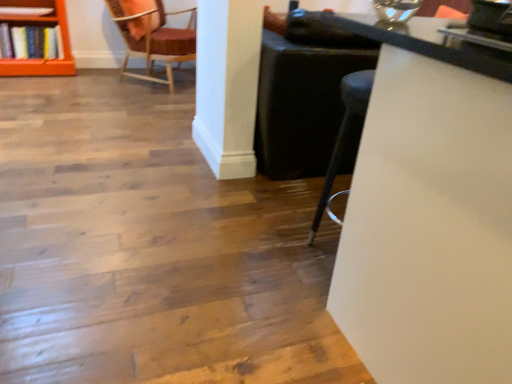
Identify the location of vacant area that is in front of orange wood shelf at upper left. Image resolution: width=512 pixels, height=384 pixels. (28, 89).